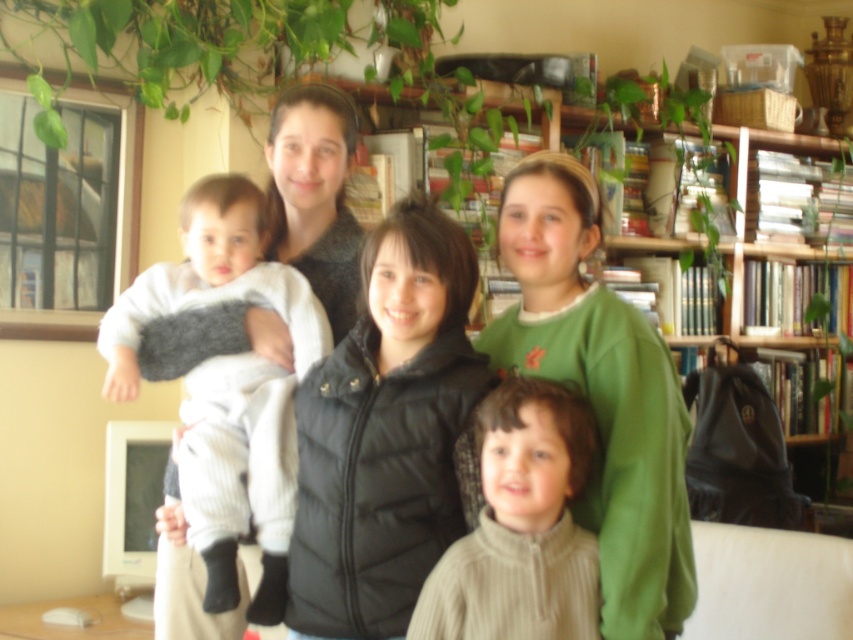
Question: Estimate the real-world distances between objects in this image. Which object is farther from the matte black jacket at center?

Choices:
 (A) white soft fabric baby at left
 (B) black puffer vest at center
 (C) green cotton shirt at upper center

Answer: (A)

Question: Is green cotton shirt at upper center bigger than white soft fabric baby at left?

Choices:
 (A) no
 (B) yes

Answer: (B)

Question: Is matte black jacket at center smaller than white soft fabric baby at left?

Choices:
 (A) no
 (B) yes

Answer: (A)

Question: Where is white soft fabric baby at left located in relation to wooden bookshelf at upper center in the image?

Choices:
 (A) right
 (B) left

Answer: (B)

Question: Based on their relative distances, which object is nearer to the black puffer vest at center?

Choices:
 (A) green cotton shirt at upper center
 (B) matte black jacket at center
 (C) white soft fabric baby at left

Answer: (C)

Question: Among these objects, which one is farthest from the camera?

Choices:
 (A) white soft fabric baby at left
 (B) black puffer vest at center
 (C) tan ribbed sweater at center

Answer: (A)